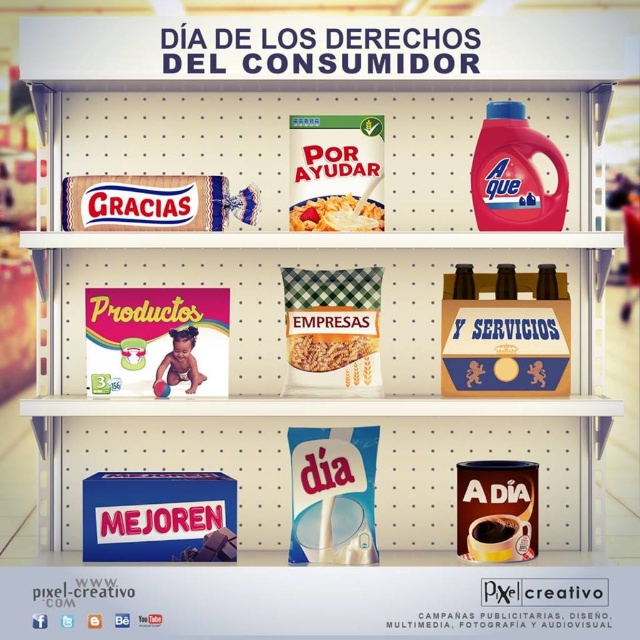
Does point (323, 307) come farther from viewer compared to point (292, 212)?

That is True.

Is green checkered fabric bag of cereal at center to the right of matte plastic cereal box at center from the viewer's perspective?

No, green checkered fabric bag of cereal at center is not to the right of matte plastic cereal box at center.

I want to click on green checkered fabric bag of cereal at center, so click(332, 328).

Where is `green checkered fabric bag of cereal at center`? Image resolution: width=640 pixels, height=640 pixels. green checkered fabric bag of cereal at center is located at coordinates pyautogui.click(x=332, y=328).

Can you confirm if matte brown coffee cup at lower right is positioned to the left of matte cardboard cereal box at center?

In fact, matte brown coffee cup at lower right is to the right of matte cardboard cereal box at center.

Between matte brown coffee cup at lower right and matte cardboard cereal box at center, which one is positioned lower?

Positioned lower is matte brown coffee cup at lower right.

Is point (484, 492) positioned in front of point (346, 356)?

That is True.

Locate an element on the screen. The height and width of the screenshot is (640, 640). matte brown coffee cup at lower right is located at coordinates (497, 509).

Does green checkered fabric bag of cereal at center appear over matte cardboard cereal box at center?

Yes.

Find the location of `green checkered fabric bag of cereal at center`. green checkered fabric bag of cereal at center is located at coordinates (332, 328).

Image resolution: width=640 pixels, height=640 pixels. I want to click on green checkered fabric bag of cereal at center, so click(x=332, y=328).